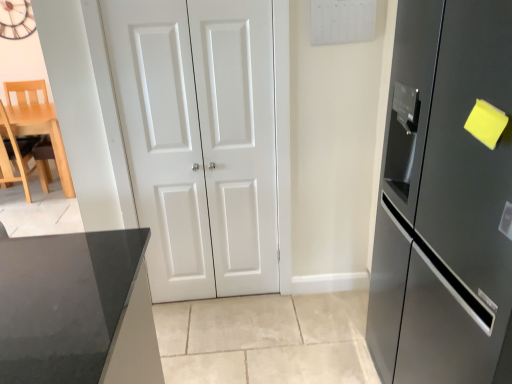
Question: Would you say light wood chair at left is a long distance from satin black refrigerator at right?

Choices:
 (A) no
 (B) yes

Answer: (B)

Question: Does light wood chair at left appear on the right side of satin black refrigerator at right?

Choices:
 (A) yes
 (B) no

Answer: (B)

Question: From the image's perspective, is light wood chair at left above satin black refrigerator at right?

Choices:
 (A) no
 (B) yes

Answer: (B)

Question: Considering the relative positions of light wood chair at left and satin black refrigerator at right in the image provided, is light wood chair at left behind satin black refrigerator at right?

Choices:
 (A) yes
 (B) no

Answer: (A)

Question: From a real-world perspective, is light wood chair at left physically above satin black refrigerator at right?

Choices:
 (A) yes
 (B) no

Answer: (B)

Question: Is light wood chair at left outside of satin black refrigerator at right?

Choices:
 (A) yes
 (B) no

Answer: (A)

Question: Is wooden clock at upper left aimed at white matte door at center, which is the 2th door in left-to-right order?

Choices:
 (A) no
 (B) yes

Answer: (A)

Question: Is wooden clock at upper left bigger than white matte door at center, which is the 2th door in left-to-right order?

Choices:
 (A) yes
 (B) no

Answer: (B)

Question: Considering the relative sizes of wooden clock at upper left and white matte door at center, positioned as the first door in right-to-left order, in the image provided, is wooden clock at upper left smaller than white matte door at center, positioned as the first door in right-to-left order,?

Choices:
 (A) no
 (B) yes

Answer: (B)

Question: Does wooden clock at upper left touch white matte door at center, positioned as the first door in right-to-left order?

Choices:
 (A) no
 (B) yes

Answer: (A)

Question: Considering the relative sizes of wooden clock at upper left and white matte door at center, which is the 2th door in left-to-right order, in the image provided, is wooden clock at upper left wider than white matte door at center, which is the 2th door in left-to-right order,?

Choices:
 (A) yes
 (B) no

Answer: (A)

Question: Is wooden clock at upper left not close to white matte door at center, positioned as the first door in right-to-left order?

Choices:
 (A) no
 (B) yes

Answer: (B)

Question: Considering the relative positions of light wood chair at left and white matte door at center, placed as the second door when sorted from right to left, in the image provided, is light wood chair at left to the right of white matte door at center, placed as the second door when sorted from right to left, from the viewer's perspective?

Choices:
 (A) yes
 (B) no

Answer: (B)